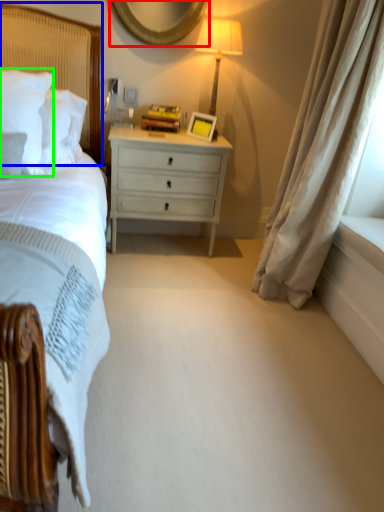
Question: Estimate the real-world distances between objects in this image. Which object is farther from mirror (highlighted by a red box), headboard (highlighted by a blue box) or pillow (highlighted by a green box)?

Choices:
 (A) headboard
 (B) pillow

Answer: (B)